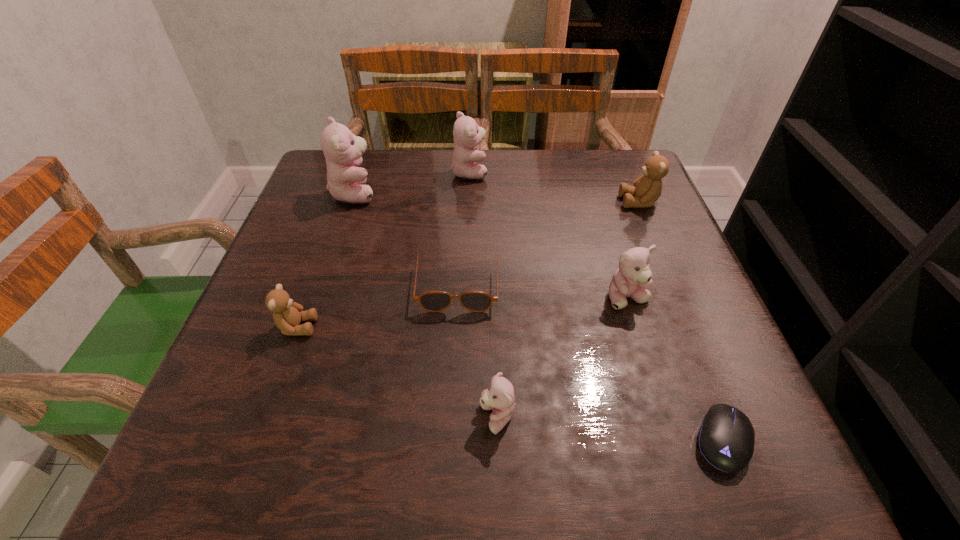
You are a GUI agent. You are given a task and a screenshot of the screen. Output one action in this format:
    pyautogui.click(x=<x>, y=<y>)
    Task: Click on the free spot that satisfies the following two spatial constraints: 1. on the face of the rightmost teddy bear; 2. at the face of the rightmost pink teddy bear
    
    Given the screenshot: What is the action you would take?
    [x=680, y=299]

The image size is (960, 540). I want to click on free space that satisfies the following two spatial constraints: 1. on the face of the computer mouse; 2. on the right side of the smaller brown teddy bear, so click(x=256, y=440).

Locate an element on the screen. Image resolution: width=960 pixels, height=540 pixels. blank space that satisfies the following two spatial constraints: 1. on the back side of the black computer mouse; 2. at the face of the seventh shortest object is located at coordinates (618, 172).